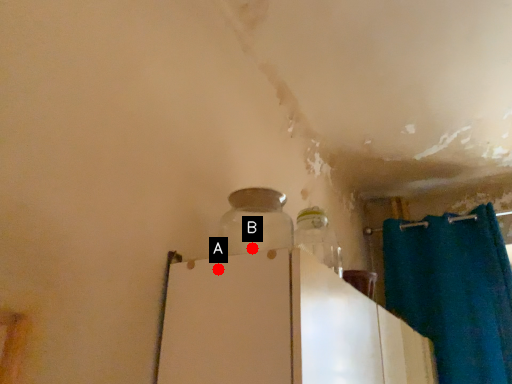
Question: Two points are circled on the image, labeled by A and B beside each circle. Which point is closer to the camera?

Choices:
 (A) A is closer
 (B) B is closer

Answer: (A)